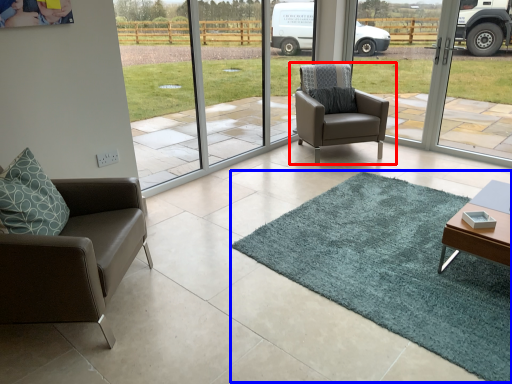
Question: Which of the following is the closest to the observer, chair (highlighted by a red box) or mat (highlighted by a blue box)?

Choices:
 (A) chair
 (B) mat

Answer: (B)